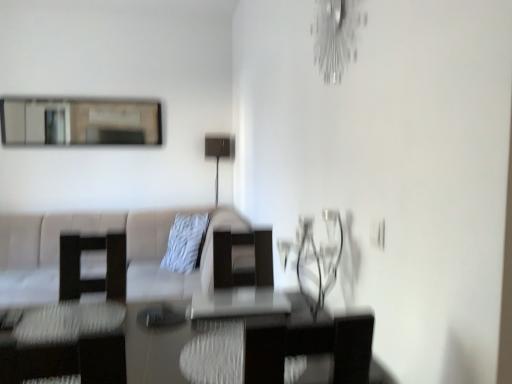
Question: From the image's perspective, relative to white textured pillow at center, is matte black lamp at center above or below?

Choices:
 (A) above
 (B) below

Answer: (A)

Question: In the image, is matte black lamp at center positioned in front of or behind white textured pillow at center?

Choices:
 (A) behind
 (B) front

Answer: (A)

Question: Which is farther from the matte black swivel chair at left?

Choices:
 (A) metallic silver light fixture at upper right
 (B) matte glass mirror at upper left
 (C) white textured pillow at center
 (D) matte black lamp at center
 (E) polished glass table at center

Answer: (B)

Question: Which is farther from the metallic silver light fixture at upper right?

Choices:
 (A) polished glass table at center
 (B) matte glass mirror at upper left
 (C) matte black lamp at center
 (D) matte black swivel chair at left
 (E) white textured pillow at center

Answer: (B)